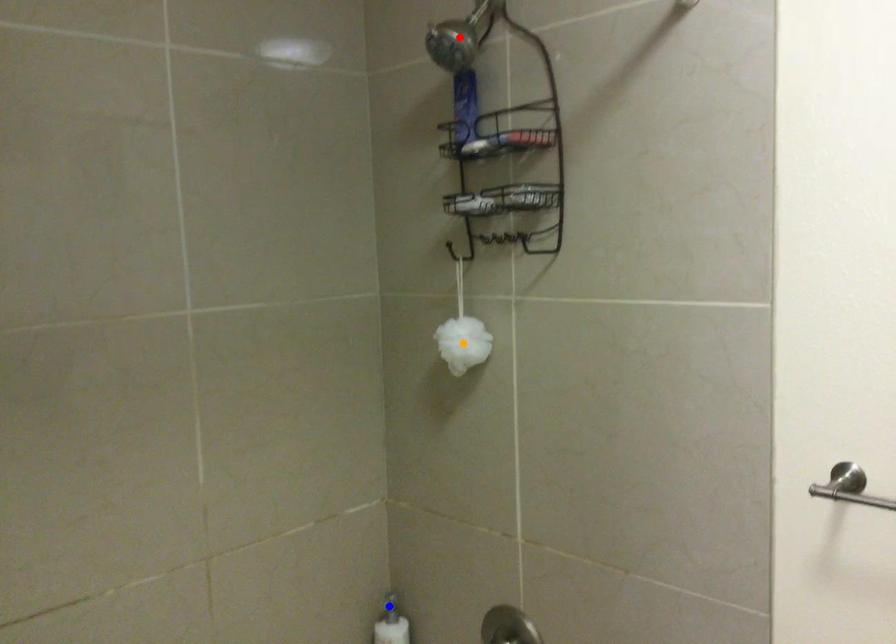
Order these from nearest to farthest:
A) blue point
B) red point
C) orange point

1. red point
2. orange point
3. blue point